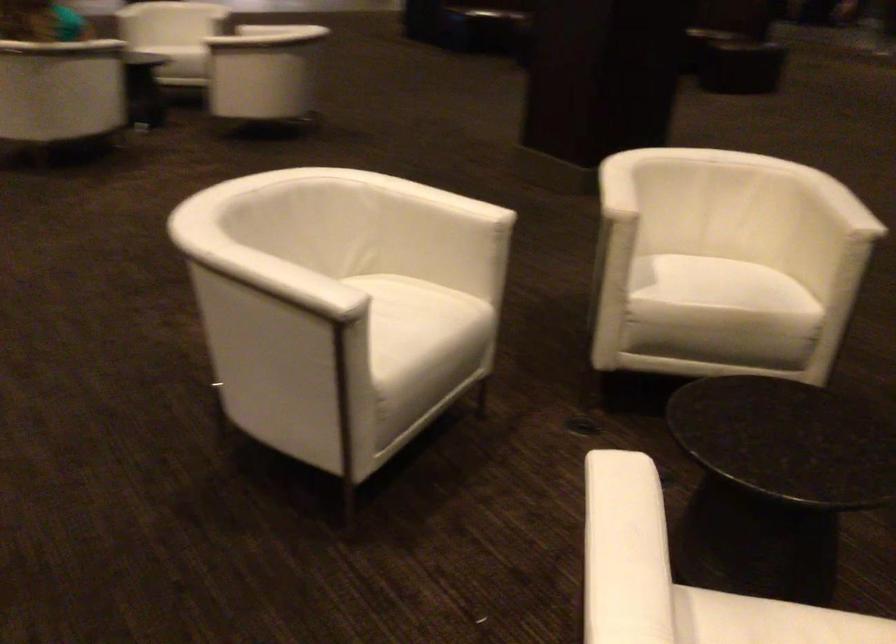
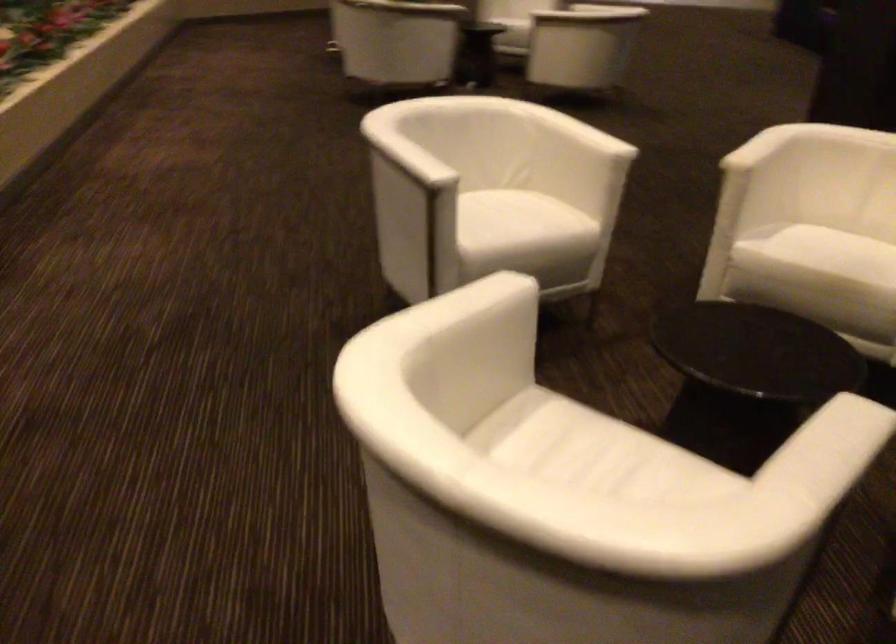
Find the pixel in the second image that matches pixel 729 292 in the first image.

(836, 252)